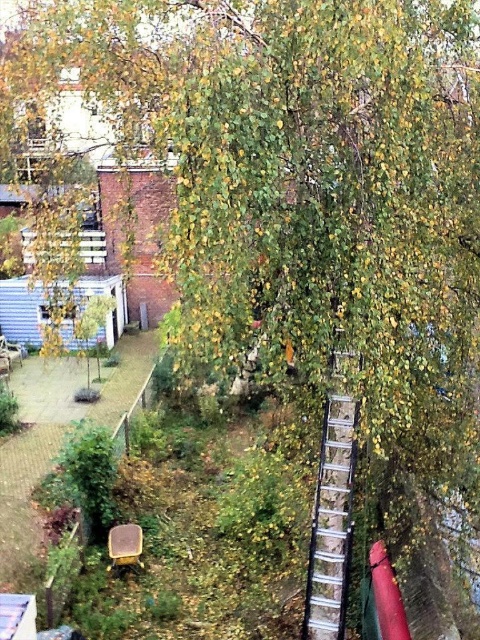
You are standing at the base of the birch tree and want to reach the silver metallic ladder at upper center. There is a matte yellow chair at lower center nearby. Do you think you can walk directly to the ladder without passing by the chair?

The distance between the silver metallic ladder at upper center and the matte yellow chair at lower center is 17.03 feet. Since the chair is much farther away from the ladder, you can walk directly to the ladder without passing by the chair.

Based on the photo, you are standing at the base of the birch tree and want to retrieve an item that fell behind the silver metallic ladder at upper center. To reach it, you need to move the ladder. However, there is the matte yellow chair at lower center in the way. Can you move the ladder without disturbing the chair?

The silver metallic ladder at upper center is above the matte yellow chair at lower center, so moving the ladder downward would allow access to the item behind it without disturbing the chair.